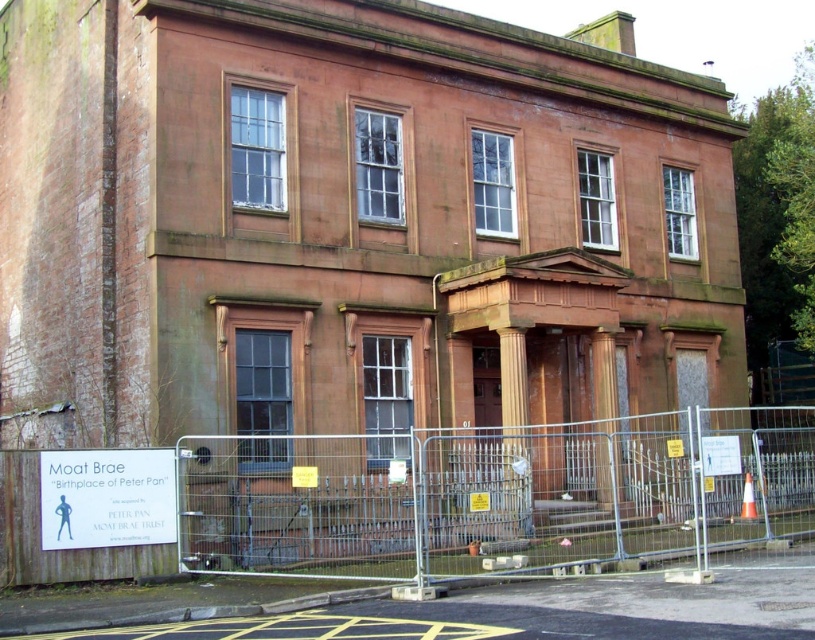
Question: Which of the following is the closest to the observer?

Choices:
 (A) silver metallic fence at center
 (B) white paper sign at lower left

Answer: (A)

Question: In this image, where is silver metallic fence at center located relative to white paper sign at lower left?

Choices:
 (A) left
 (B) right

Answer: (B)

Question: Among these objects, which one is farthest from the camera?

Choices:
 (A) silver metallic fence at center
 (B) white paper sign at lower left

Answer: (B)

Question: Among these points, which one is farthest from the camera?

Choices:
 (A) (71, 468)
 (B) (496, 534)

Answer: (B)

Question: Does silver metallic fence at center come behind white paper sign at lower left?

Choices:
 (A) yes
 (B) no

Answer: (B)

Question: Can you confirm if silver metallic fence at center is positioned below white paper sign at lower left?

Choices:
 (A) no
 (B) yes

Answer: (B)